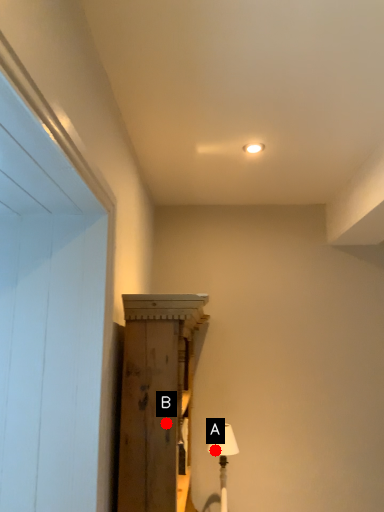
Question: Two points are circled on the image, labeled by A and B beside each circle. Which point appears farthest from the camera in this image?

Choices:
 (A) A is further
 (B) B is further

Answer: (A)